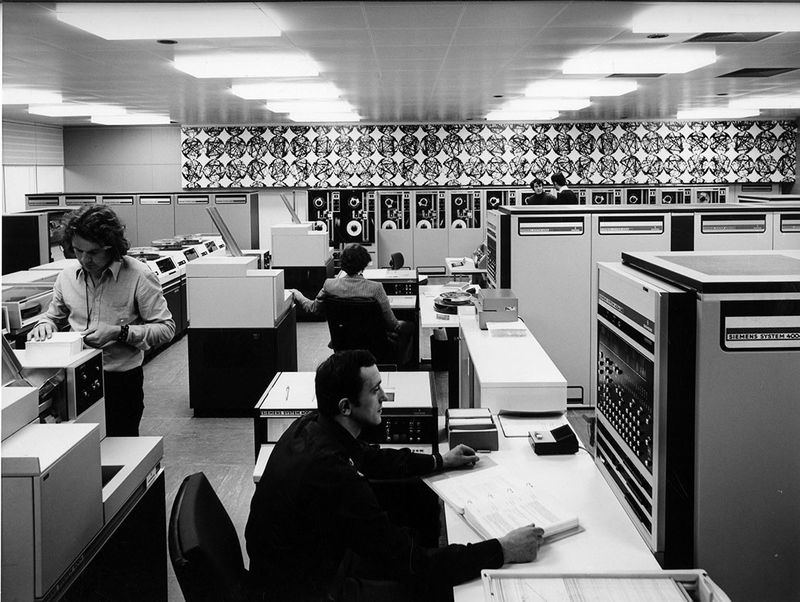
This screenshot has width=800, height=602. I want to click on chair, so click(250, 563), click(345, 323).